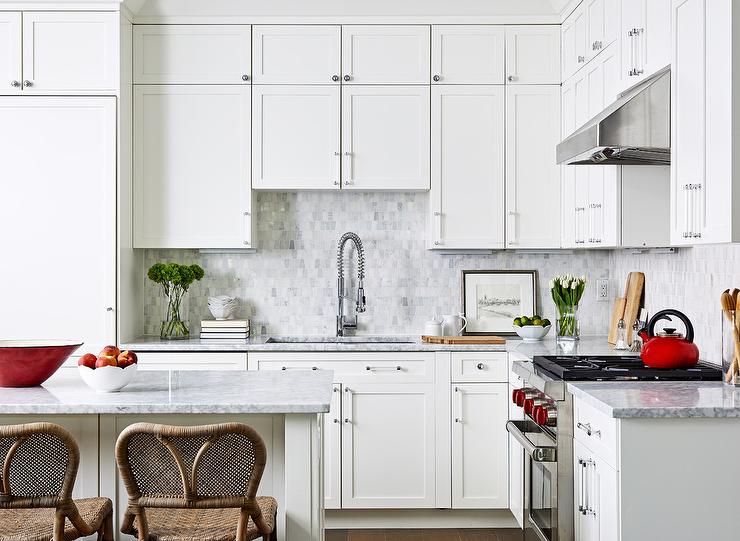
In order to click on oven in this screenshot , I will do `click(564, 415)`.